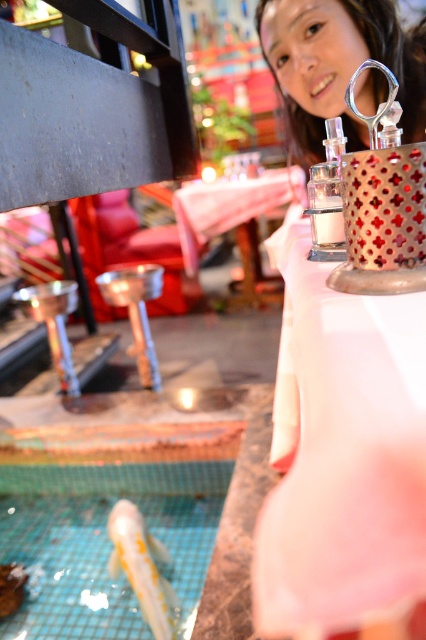
Is point (143, 614) behind point (112, 282)?

No, it is in front of (112, 282).

From the picture: Between yellow glossy chopsticks at lower left and metallic polished stool at center, which one appears on the left side from the viewer's perspective?

metallic polished stool at center is more to the left.

Is point (158, 576) positioned before point (141, 301)?

Yes.

Identify the location of yellow glossy chopsticks at lower left. The width and height of the screenshot is (426, 640). (141, 566).

Describe the element at coordinates (337, 65) in the screenshot. I see `smooth skin girl at upper center` at that location.

Does smooth skin girl at upper center have a greater width compared to yellow glossy chopsticks at lower left?

Yes.

Locate an element on the screen. The image size is (426, 640). smooth skin girl at upper center is located at coordinates (337, 65).

The height and width of the screenshot is (640, 426). Describe the element at coordinates (103, 541) in the screenshot. I see `white glossy fish at bottom left` at that location.

Does white glossy fish at bottom left appear under yellow glossy chopsticks at lower left?

Actually, white glossy fish at bottom left is above yellow glossy chopsticks at lower left.

The width and height of the screenshot is (426, 640). I want to click on white glossy fish at bottom left, so click(103, 541).